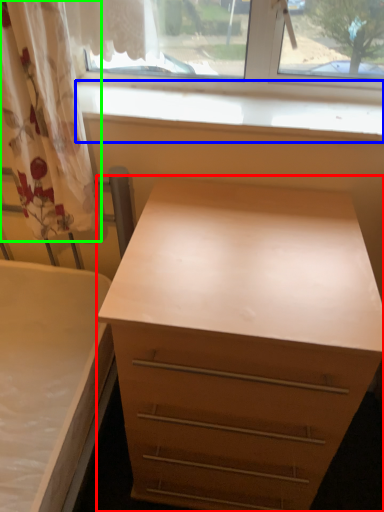
Question: Based on their relative distances, which object is nearer to chest of drawers (highlighted by a red box)? Choose from window sill (highlighted by a blue box) and curtain (highlighted by a green box).

Choices:
 (A) window sill
 (B) curtain

Answer: (B)